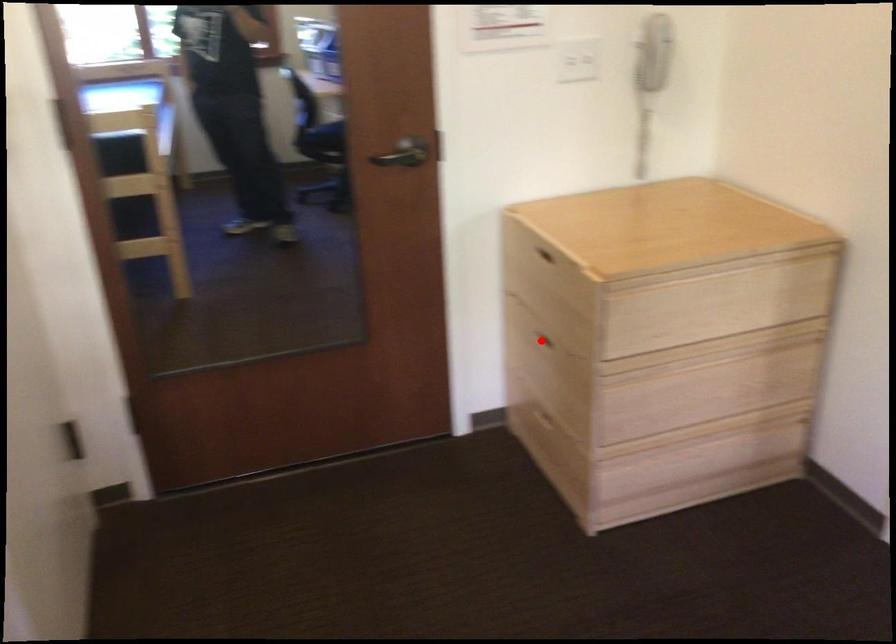
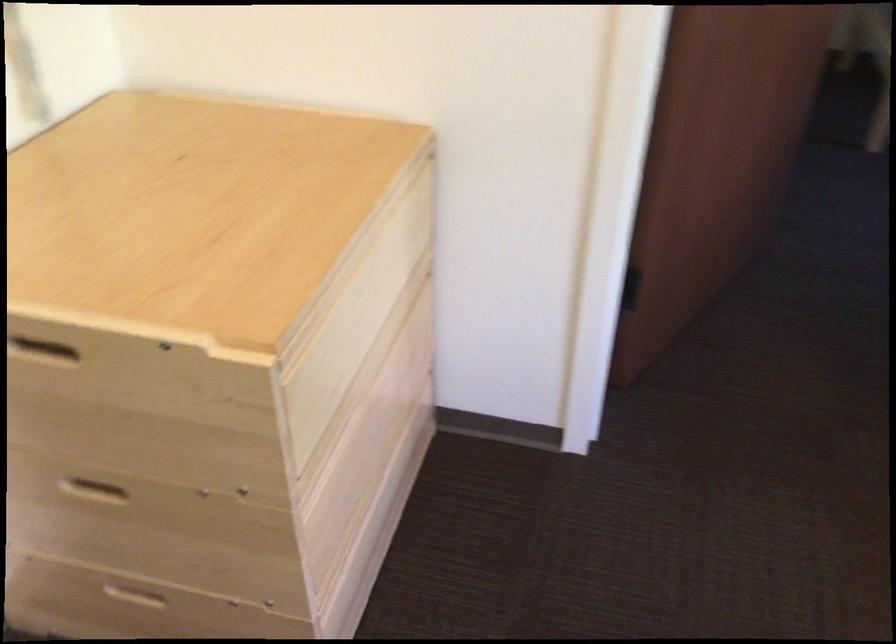
Find the pixel in the second image that matches the highlighted location in the first image.

(90, 488)